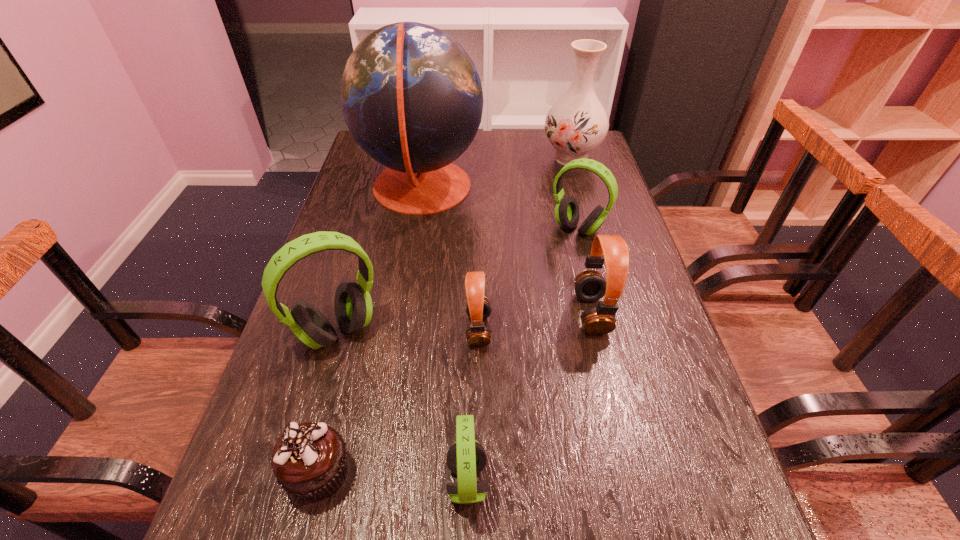
Find the location of a particular element. The width and height of the screenshot is (960, 540). cupcake is located at coordinates (309, 460).

The image size is (960, 540). I want to click on brown cupcake, so click(309, 460).

Where is `vacant region located 0.060m with the Americas facing the viewer on the tallest object`? This screenshot has width=960, height=540. vacant region located 0.060m with the Americas facing the viewer on the tallest object is located at coordinates (503, 188).

Identify the location of free space located 0.310m on the front of the vase. (593, 237).

Locate an element on the screen. This screenshot has width=960, height=540. blank space located on the right of the second farthest green headset is located at coordinates (492, 331).

Find the location of `free spot located 0.350m on the ear cups of the right brown headset`. free spot located 0.350m on the ear cups of the right brown headset is located at coordinates (420, 313).

Identify the location of free space located 0.160m on the ear cups of the right brown headset. coord(504,313).

This screenshot has width=960, height=540. I want to click on vacant space located 0.100m on the ear cups of the right brown headset, so click(x=531, y=313).

Find the location of `vacant region located on the left of the rightmost green headset`. vacant region located on the left of the rightmost green headset is located at coordinates (468, 228).

Locate an element on the screen. The height and width of the screenshot is (540, 960). free space located on the ear cups of the left brown headset is located at coordinates (546, 329).